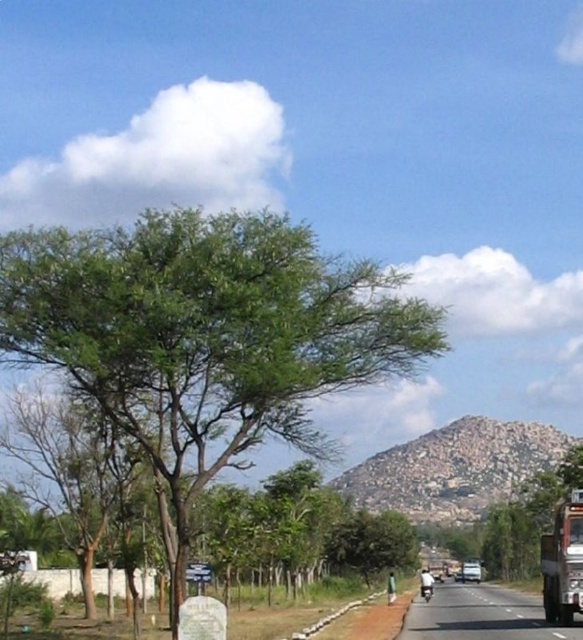
You are standing at the point labeled as point (205, 336) in the image. Looking around, you see a large tree with a dense canopy of green leaves on the left side of the frame. What is the closest object to your current position?

The closest object to your current position at point (205, 336) is the green leafy tree at center, as the point indicates its location.

You are a pedestrian standing on the black asphalt road at center. You see the metallic silver trailer truck at right approaching you. The truck is moving at 15 km per hour. Can you safely step onto the road to cross it before the truck arrives?

The distance between the black asphalt road at center and the metallic silver trailer truck at right is 6.12 meters. At 15 km per hour, the truck would take approximately 1.7 seconds to cover that distance. Since pedestrians need at least 3 seconds to cross safely, you should not step onto the road and wait until the truck passes.

You are driving a car and want to cross the black asphalt road at center. There is a green leafy tree at center blocking your path. Can you safely drive around the tree without hitting it?

The green leafy tree at center is positioned over the black asphalt road at center, so you cannot safely drive around it without hitting the tree. You should find an alternative route or detour.